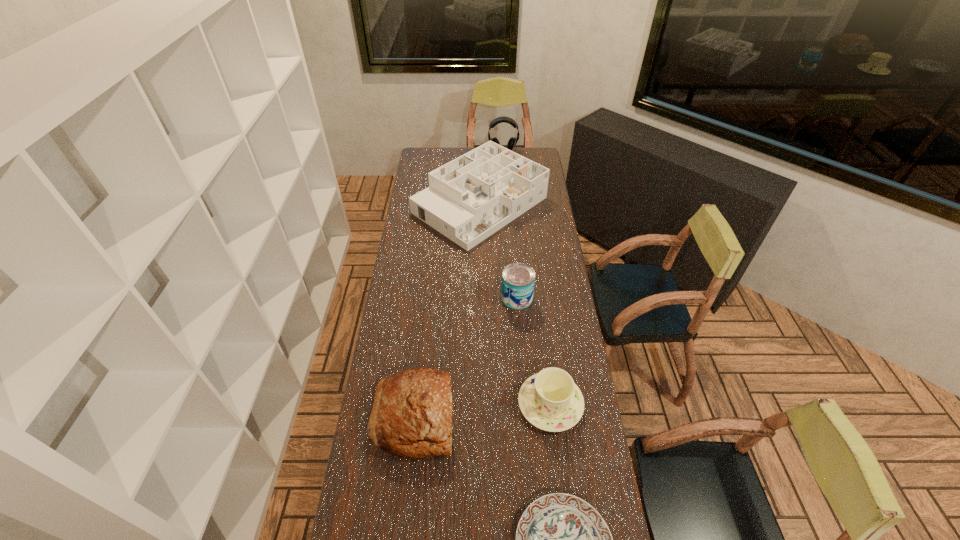
What are the coordinates of `chinaware positioned at the right edge` in the screenshot? It's located at (550, 400).

Locate an element on the screen. The height and width of the screenshot is (540, 960). object at the far left corner is located at coordinates (468, 199).

Identify the location of earphone at the far right corner. This screenshot has height=540, width=960. (512, 142).

What are the coordinates of `dollhouse located at the far right corner` in the screenshot? It's located at (468, 199).

Locate an element on the screen. vacant area at the left edge of the desktop is located at coordinates (382, 342).

In the image, there is a desktop. Where is `vacant region at the right edge`? Image resolution: width=960 pixels, height=540 pixels. vacant region at the right edge is located at coordinates (538, 238).

I want to click on free space between the bread and the can, so click(466, 356).

I want to click on vacant space that's between the bread and the tallest object, so click(458, 283).

Locate an element on the screen. This screenshot has height=540, width=960. unoccupied area between the can and the chinaware is located at coordinates (534, 350).

Identify which object is located as the fifth nearest to the chinaware. Please provide its 2D coordinates. Your answer should be formatted as a tuple, i.e. [(x, y)], where the tuple contains the x and y coordinates of a point satisfying the conditions above.

[(512, 142)]